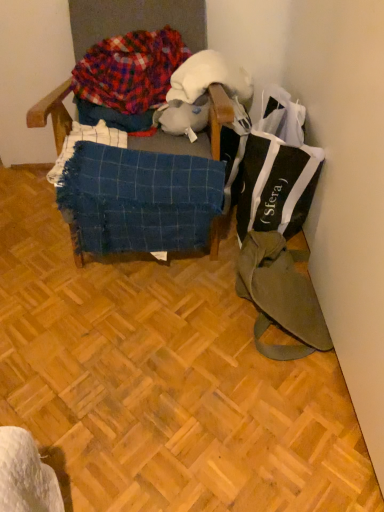
The image size is (384, 512). I want to click on free location to the left of wooden chair at center, so click(x=31, y=231).